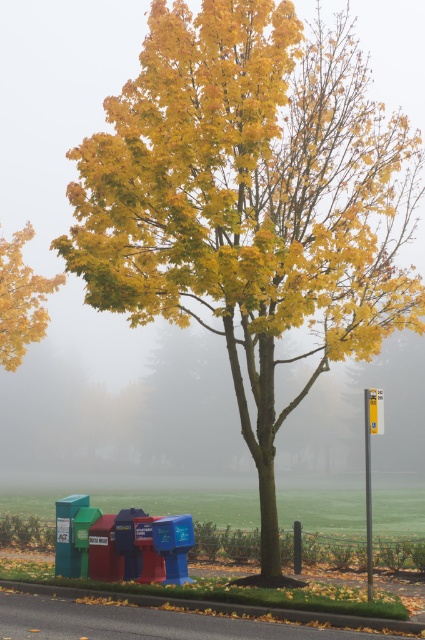
You are a delivery driver who needs to park your van near the green rubber curb at lower center. However, there is a yellow matte tree at upper left nearby. Can you estimate whether the space between the tree and the curb is wide enough for your van to maneuver safely?

The yellow matte tree at upper left might be wider than green rubber curb at lower center, so there could be insufficient space for the van to maneuver safely. It is advisable to choose a different parking spot.

You are a delivery person trying to navigate through the foggy area. You see the yellow matte tree at upper left and the green rubber curb at lower center. Which object is positioned higher in the image?

The yellow matte tree at upper left is located above the green rubber curb at lower center, so it is positioned higher in the image.